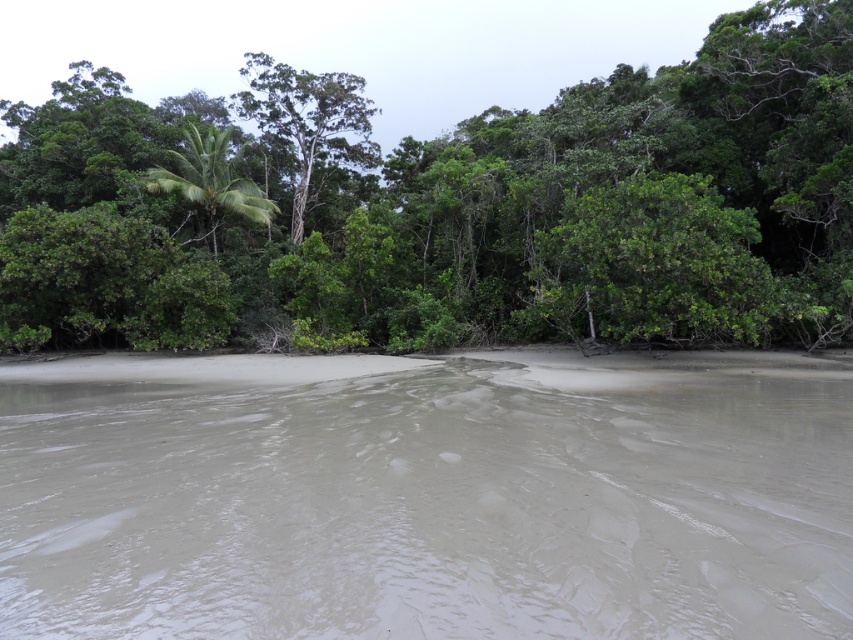
You are standing on the sandy area in the foreground and want to walk towards the forest. You notice two trees in the background. Which tree, the green leafy tree at upper center or the green leafy palm at upper left, is positioned higher up in the image?

The green leafy tree at upper center is positioned higher up in the image than the green leafy palm at upper left.

Based on the scene described, which object is wider when comparing the green leafy tree at upper center and the green leafy palm at upper left?

The green leafy tree at upper center is wider than the green leafy palm at upper left.